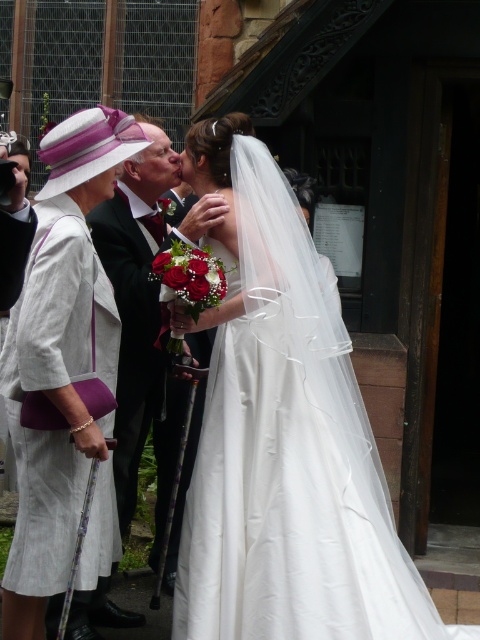
You are a photographer at a wedding and need to arrange the couple and guests for a group photo. The white linen dress at left and the black satin suit at center are in your frame. Considering their clothing thickness, which one would you position closer to the camera to ensure both appear equally sized in the photo?

The white linen dress at left is thinner than the black satin suit at center. To make them appear equally sized, position the white linen dress at left closer to the camera since its thinner form requires less distance to maintain proportional visibility compared to the bulkier black satin suit at center.

You are a photographer at the wedding ceremony. You need to position a spotlight to highlight the white satin dress at center. Based on the coordinates provided, where should you aim the spotlight?

The white satin dress at center is located at point (284, 436), so you should aim the spotlight at those coordinates to highlight it.

You are standing at the point labeled point (136, 180) and want to move to the point labeled point (248, 488). Is there a clear path between these two points without any obstacles?

Yes, there is a clear path between point (136, 180) and point (248, 488) since point (248, 488) is in front of point (136, 180), indicating they are aligned along the same line of sight without obstruction.